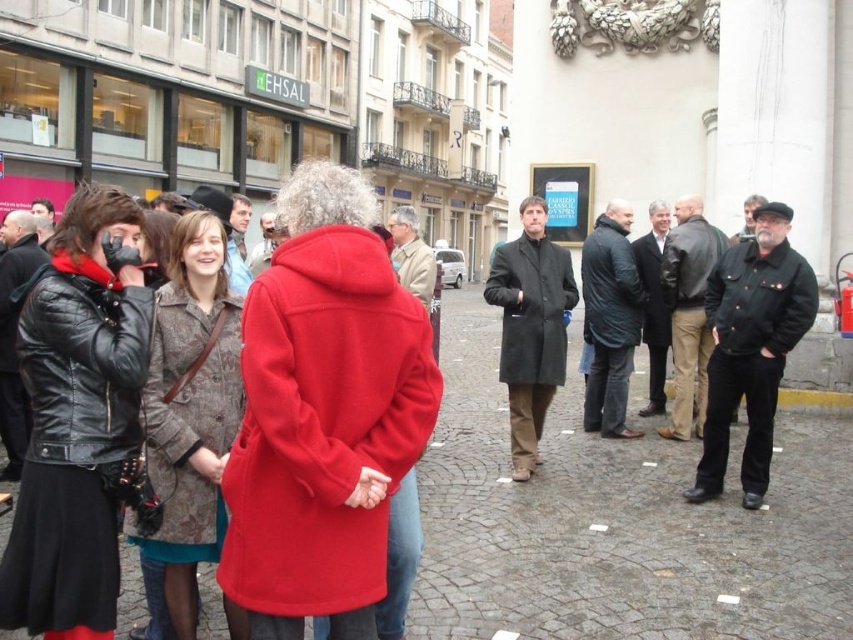
You are a tailor observing the matte black coat at center and the dark brown textured jacket at right in the scene. Which one appears bigger in size?

The matte black coat at center appears bigger in size compared to the dark brown textured jacket at right.

You are a photographer standing on the street and want to capture both the black leather jacket at left and the matte beige coat at center in a single shot. Based on their positions, which coat should you focus on first to ensure both are in frame?

The black leather jacket at left is located below the matte beige coat at center, so you should focus on the matte beige coat at center first to ensure both are in frame.